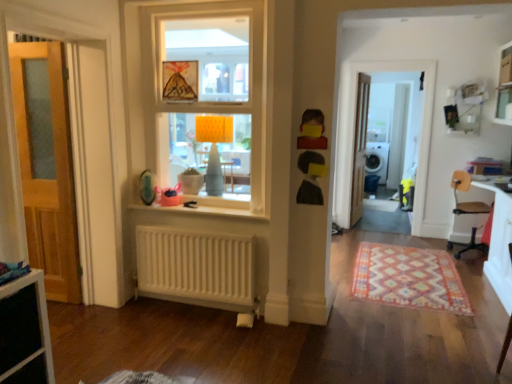
Question: Is white plastic chair at right thinner than white glossy screen door at center, which is the first screen door from right to left?

Choices:
 (A) yes
 (B) no

Answer: (B)

Question: From a real-world perspective, is white plastic chair at right beneath white glossy screen door at center, arranged as the second screen door when viewed from the front?

Choices:
 (A) yes
 (B) no

Answer: (A)

Question: Does white plastic chair at right appear on the left side of white glossy screen door at center, which is counted as the 2th screen door, starting from the left?

Choices:
 (A) no
 (B) yes

Answer: (A)

Question: Does white plastic chair at right have a greater width compared to white glossy screen door at center, which is the first screen door from right to left?

Choices:
 (A) yes
 (B) no

Answer: (A)

Question: Is white glossy screen door at center, acting as the first screen door starting from the back, a part of white plastic chair at right?

Choices:
 (A) yes
 (B) no

Answer: (B)

Question: From their relative heights in the image, would you say white glossy screen door at center, the 1th screen door from the front, is taller or shorter than white plastic chair at right?

Choices:
 (A) short
 (B) tall

Answer: (B)

Question: Does point (348, 132) appear closer or farther from the camera than point (454, 190)?

Choices:
 (A) closer
 (B) farther

Answer: (B)

Question: From a real-world perspective, is white glossy screen door at center, the 2th screen door in the back-to-front sequence, physically located above or below white plastic chair at right?

Choices:
 (A) below
 (B) above

Answer: (B)

Question: Is white glossy screen door at center, which ranks as the first screen door in left-to-right order, to the left or to the right of white plastic chair at right in the image?

Choices:
 (A) left
 (B) right

Answer: (A)

Question: From a real-world perspective, is yellow matte toy at upper center, acting as the second toy starting from the left, above or below white painted wood window at center?

Choices:
 (A) above
 (B) below

Answer: (B)

Question: In terms of width, does yellow matte toy at upper center, which ranks as the 2th toy in right-to-left order, look wider or thinner when compared to white painted wood window at center?

Choices:
 (A) thin
 (B) wide

Answer: (A)

Question: From the image's perspective, is yellow matte toy at upper center, acting as the second toy starting from the left, above or below white painted wood window at center?

Choices:
 (A) below
 (B) above

Answer: (A)

Question: In the image, is yellow matte toy at upper center, which is counted as the first toy, starting from the front, on the left side or the right side of white painted wood window at center?

Choices:
 (A) left
 (B) right

Answer: (B)

Question: From the image's perspective, is yellow matte toy at upper center, which is counted as the first toy, starting from the front, located above or below white plastic chair at right?

Choices:
 (A) above
 (B) below

Answer: (A)

Question: In terms of width, does yellow matte toy at upper center, acting as the second toy starting from the left, look wider or thinner when compared to white plastic chair at right?

Choices:
 (A) wide
 (B) thin

Answer: (B)